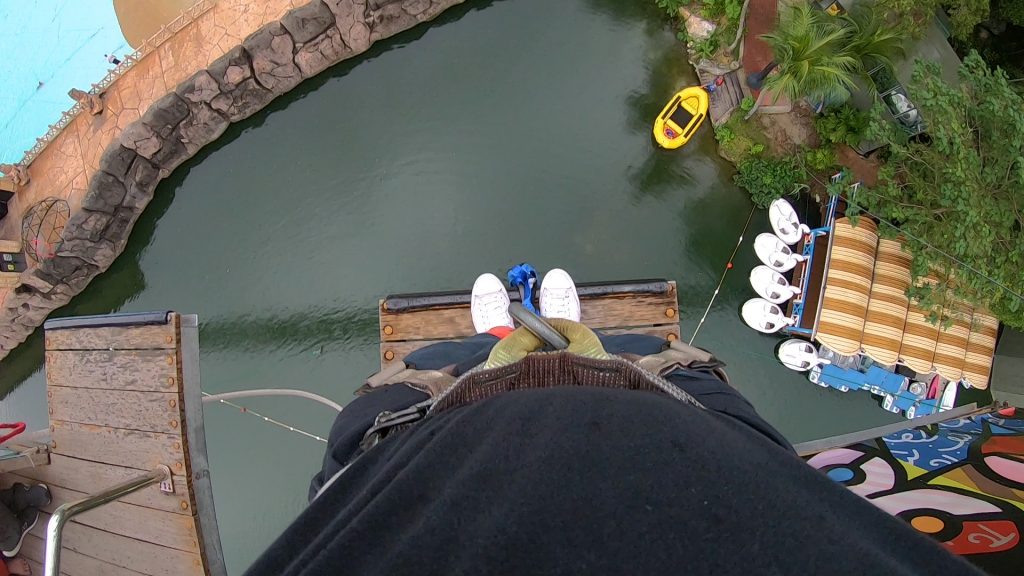
The width and height of the screenshot is (1024, 576). I want to click on wood landing, so click(x=114, y=414), click(x=421, y=324).